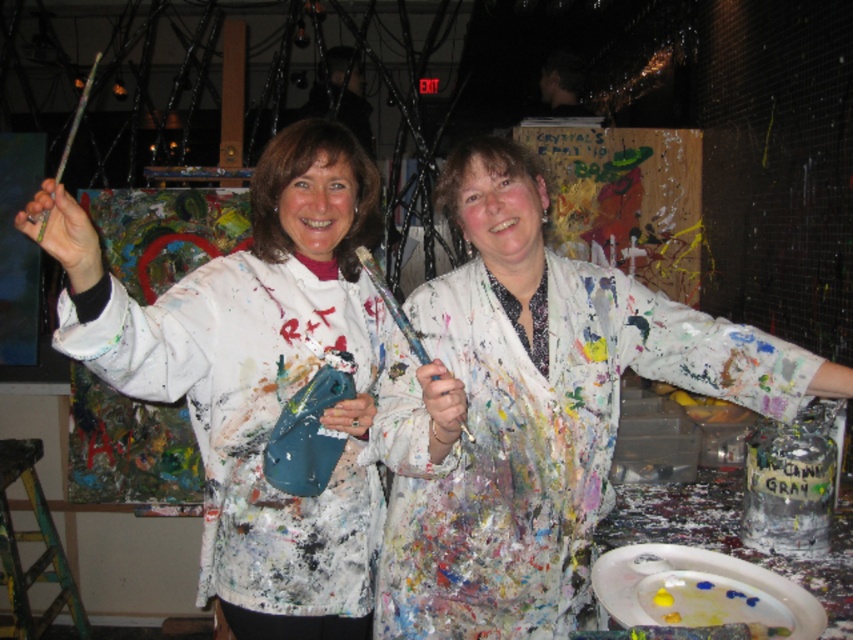
Question: Can you confirm if paint-splattered white shirt at center is positioned above green metallic paint brush at upper left?

Choices:
 (A) yes
 (B) no

Answer: (B)

Question: Which object is farther from the camera taking this photo?

Choices:
 (A) worn wooden paintbrush at center
 (B) paint-splattered white shirt at center
 (C) green metallic paint brush at upper left
 (D) white paint-splattered shirt at center

Answer: (B)

Question: Does paint-splattered white shirt at center come in front of green metallic paint brush at upper left?

Choices:
 (A) yes
 (B) no

Answer: (B)

Question: Which of the following is the closest to the observer?

Choices:
 (A) white paint-splattered shirt at center
 (B) worn wooden paintbrush at center
 (C) paint-splattered white shirt at center

Answer: (A)

Question: From the image, what is the correct spatial relationship of white paint-splattered shirt at center in relation to green metallic paint brush at upper left?

Choices:
 (A) right
 (B) left

Answer: (A)

Question: Which point is closer to the camera?

Choices:
 (A) (86, 90)
 (B) (223, 490)

Answer: (A)